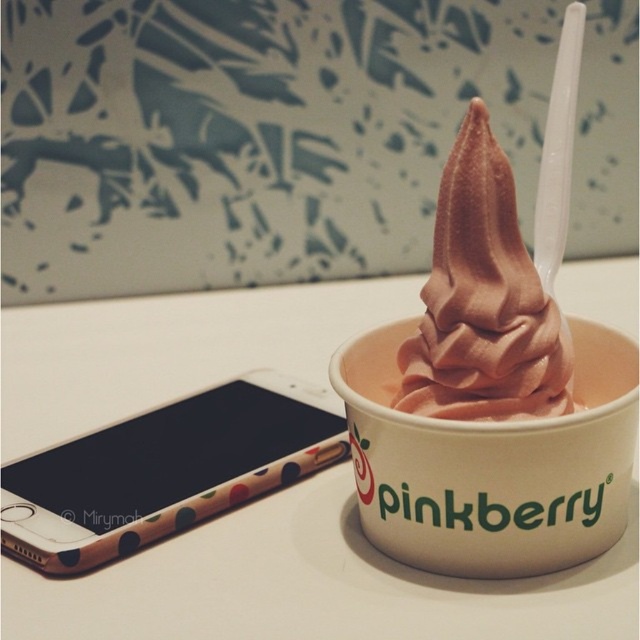
Is polka dot plastic phone at lower left positioned behind chocolate soft serve at center?

Yes, polka dot plastic phone at lower left is behind chocolate soft serve at center.

Is polka dot plastic phone at lower left below chocolate soft serve at center?

Indeed, polka dot plastic phone at lower left is positioned under chocolate soft serve at center.

Between point (125, 486) and point (506, 301), which one is positioned behind?

The point (125, 486) is behind.

At what (x,y) coordinates should I click in order to perform the action: click on polka dot plastic phone at lower left. Please return your answer as a coordinate pair (x, y). This screenshot has width=640, height=640. Looking at the image, I should click on (164, 472).

Between white glossy table at center and polka dot plastic phone at lower left, which one appears on the right side from the viewer's perspective?

From the viewer's perspective, white glossy table at center appears more on the right side.

Can you confirm if white glossy table at center is positioned above polka dot plastic phone at lower left?

Yes, white glossy table at center is above polka dot plastic phone at lower left.

Does point (364, 561) come closer to viewer compared to point (77, 525)?

Yes, it is in front of point (77, 525).

You are a GUI agent. You are given a task and a screenshot of the screen. Output one action in this format:
    pyautogui.click(x=<x>, y=<y>)
    Task: Click on the white glossy table at center
    This screenshot has width=640, height=640.
    Given the screenshot: What is the action you would take?
    pyautogui.click(x=314, y=586)

Which is above, white glossy table at center or chocolate soft serve at center?

chocolate soft serve at center

Can you confirm if white glossy table at center is smaller than chocolate soft serve at center?

Incorrect, white glossy table at center is not smaller in size than chocolate soft serve at center.

The image size is (640, 640). In order to click on white glossy table at center in this screenshot , I will do `click(314, 586)`.

What are the coordinates of `white glossy table at center` in the screenshot? It's located at (314, 586).